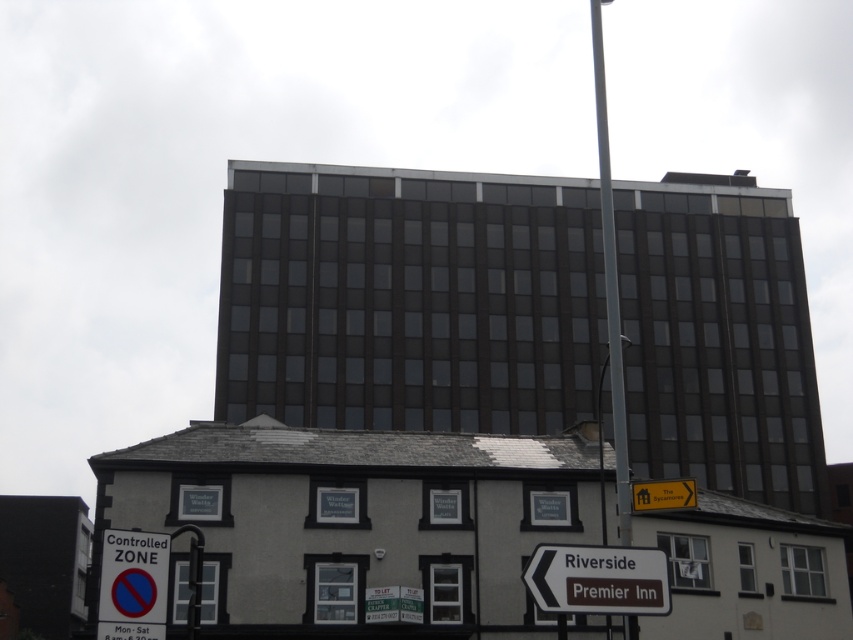
Can you confirm if white plastic sign at lower left is thinner than yellow plastic sign at upper right?

Indeed, white plastic sign at lower left has a lesser width compared to yellow plastic sign at upper right.

Does white plastic sign at lower left appear on the left side of yellow plastic sign at upper right?

Yes, white plastic sign at lower left is to the left of yellow plastic sign at upper right.

Which is behind, point (138, 604) or point (689, 499)?

The point (689, 499) is more distant.

Locate an element on the screen. white plastic sign at lower left is located at coordinates (132, 586).

Can you confirm if silver metallic pole at upper right is positioned below yellow plastic sign at upper right?

No, silver metallic pole at upper right is not below yellow plastic sign at upper right.

Does point (630, 621) come closer to viewer compared to point (668, 481)?

Yes.

Describe the element at coordinates (610, 282) in the screenshot. Image resolution: width=853 pixels, height=640 pixels. I see `silver metallic pole at upper right` at that location.

I want to click on silver metallic pole at upper right, so click(x=610, y=282).

Based on the photo, which is more to the left, brown matte sign at lower center or silver metallic pole at upper right?

brown matte sign at lower center

Who is taller, brown matte sign at lower center or silver metallic pole at upper right?

With more height is silver metallic pole at upper right.

Who is more distant from viewer, (642, 579) or (618, 356)?

The point (618, 356) is more distant.

The width and height of the screenshot is (853, 640). I want to click on brown matte sign at lower center, so click(x=598, y=579).